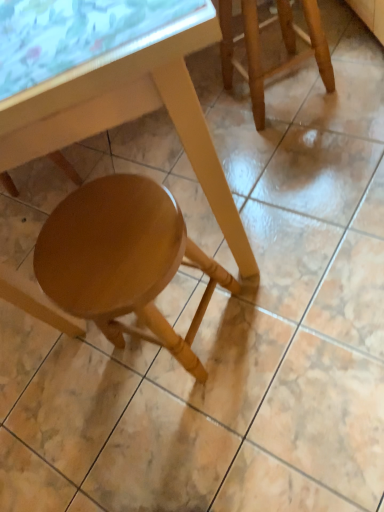
Where is `free space in front of glossy wood stool at lower center, which is the second stool in top-to-bottom order`? The width and height of the screenshot is (384, 512). free space in front of glossy wood stool at lower center, which is the second stool in top-to-bottom order is located at coordinates (232, 430).